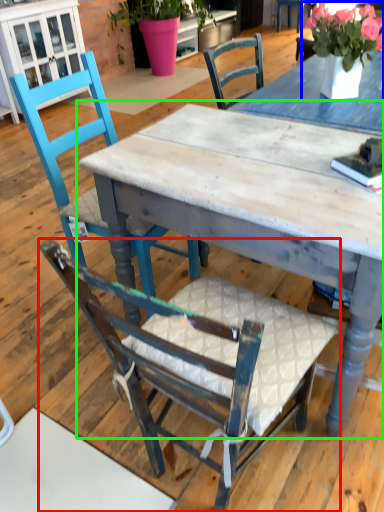
Question: Which object is positioned farthest from chair (highlighted by a red box)? Select from floral arrangement (highlighted by a blue box) and table (highlighted by a green box).

Choices:
 (A) floral arrangement
 (B) table

Answer: (A)